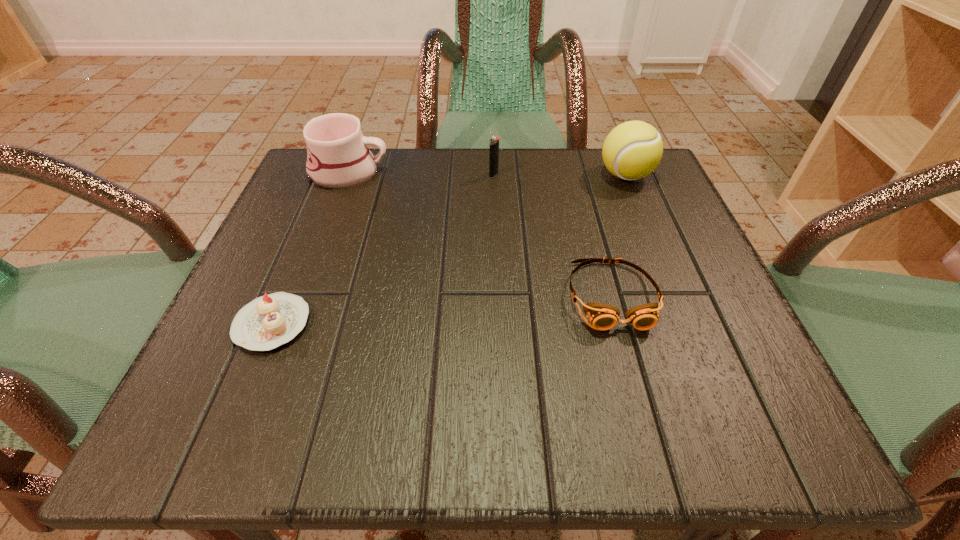
This screenshot has height=540, width=960. Identify the location of unoccupied position between the tennis ball and the third object from right to left. (560, 176).

Find the location of `unoccupied position between the cupcake and the third object from right to left`. unoccupied position between the cupcake and the third object from right to left is located at coordinates (383, 249).

You are a GUI agent. You are given a task and a screenshot of the screen. Output one action in this format:
    pyautogui.click(x=<x>, y=<y>)
    Task: Click on the vacant space that's between the cupcake and the igniter
    This screenshot has width=960, height=540.
    Given the screenshot: What is the action you would take?
    pyautogui.click(x=383, y=249)

I want to click on vacant space that's between the goggles and the tennis ball, so tap(618, 235).

Locate an element on the screen. The width and height of the screenshot is (960, 540). blank region between the tennis ball and the mug is located at coordinates (487, 174).

I want to click on vacant area that lies between the igniter and the mug, so click(x=421, y=173).

Locate an element on the screen. The width and height of the screenshot is (960, 540). object identified as the fourth closest to the mug is located at coordinates (632, 150).

Point out which object is positioned as the second nearest to the tennis ball. Please provide its 2D coordinates. Your answer should be formatted as a tuple, i.e. [(x, y)], where the tuple contains the x and y coordinates of a point satisfying the conditions above.

[(494, 141)]

Identify the location of vacant space that satisfies the following two spatial constraints: 1. on the front side of the tennis ball; 2. on the right side of the third object from right to left. The height and width of the screenshot is (540, 960). (493, 176).

Image resolution: width=960 pixels, height=540 pixels. Identify the location of free spot that satisfies the following two spatial constraints: 1. on the back side of the tennis ball; 2. on the side with the handle of the mug. (624, 172).